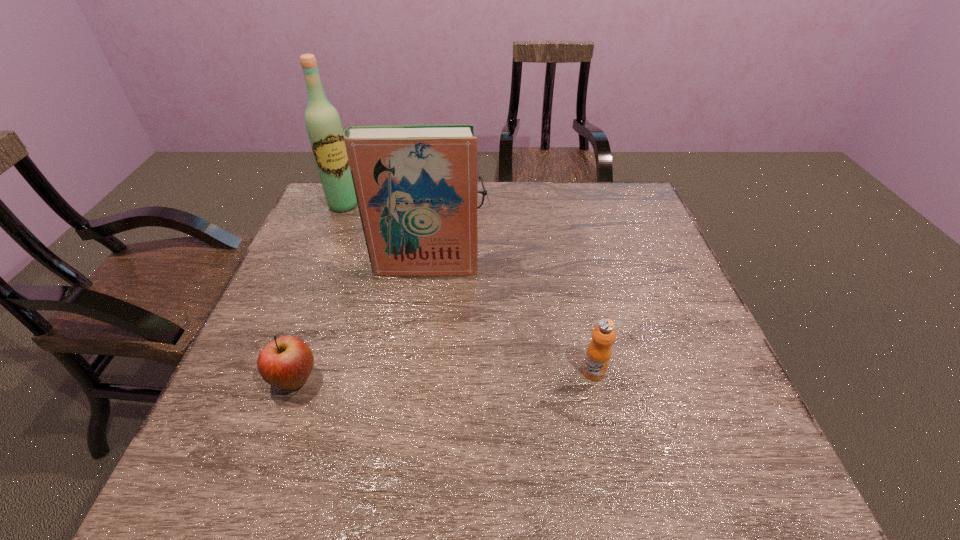
Locate which object is the closest to the shortest object. Please provide its 2D coordinates. Your answer should be formatted as a tuple, i.e. [(x, y)], where the tuple contains the x and y coordinates of a point satisfying the conditions above.

[(323, 124)]

Where is `free region that satisfies the following two spatial constraints: 1. on the front side of the wine bottle; 2. on the left side of the apple`? This screenshot has height=540, width=960. free region that satisfies the following two spatial constraints: 1. on the front side of the wine bottle; 2. on the left side of the apple is located at coordinates (273, 380).

This screenshot has width=960, height=540. What are the coordinates of `free space that satisfies the following two spatial constraints: 1. on the front side of the fourth tallest object; 2. on the left side of the wine bottle` in the screenshot? It's located at (273, 380).